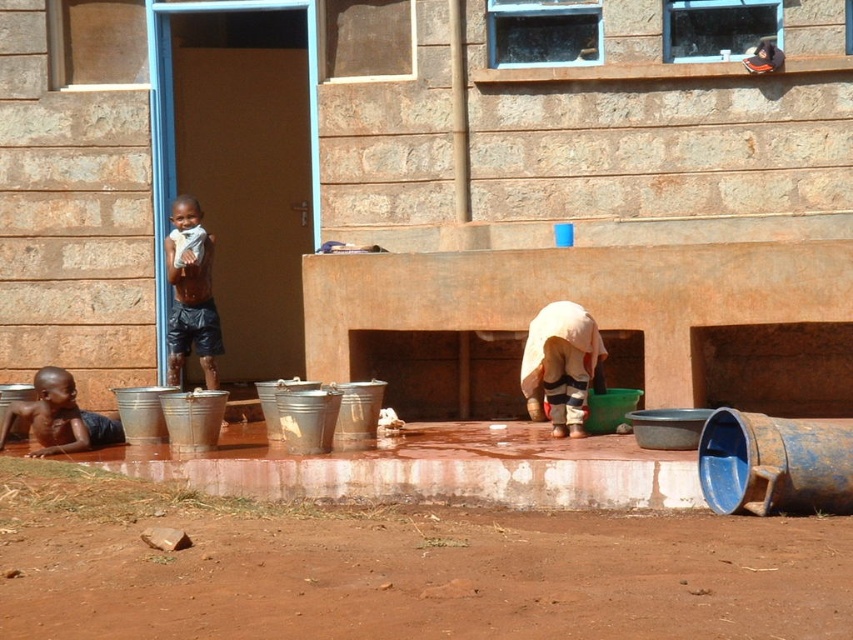
Does light beige fabric at lower center have a smaller size compared to dark brown shorts at left?

Indeed, light beige fabric at lower center has a smaller size compared to dark brown shorts at left.

Who is lower down, light beige fabric at lower center or dark brown shorts at left?

Positioned lower is light beige fabric at lower center.

Consider the image. Measure the distance between point (575, 308) and camera.

A distance of 11.73 meters exists between point (575, 308) and camera.

Where is `light beige fabric at lower center`? The height and width of the screenshot is (640, 853). light beige fabric at lower center is located at coordinates (560, 365).

Is brown dirt field at lower center shorter than light beige fabric at lower center?

Yes.

Is brown dirt field at lower center to the left of light beige fabric at lower center from the viewer's perspective?

Yes, brown dirt field at lower center is to the left of light beige fabric at lower center.

Find the location of `brown dirt field at lower center`. brown dirt field at lower center is located at coordinates (399, 568).

Is brown stone wall at center further to camera compared to dark brown shorts at left?

Yes, it is behind dark brown shorts at left.

How distant is brown stone wall at center from dark brown shorts at left?

brown stone wall at center and dark brown shorts at left are 1.84 meters apart.

Locate an element on the screen. brown stone wall at center is located at coordinates (579, 132).